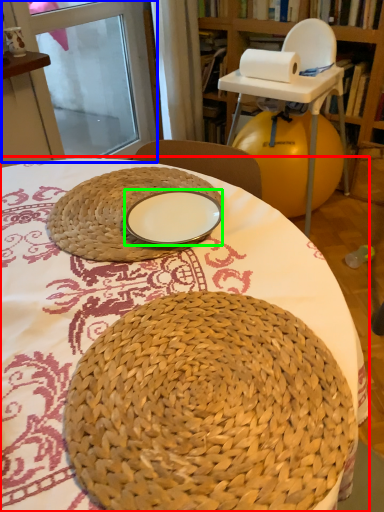
Question: Based on their relative distances, which object is farther from table (highlighted by a red box)? Choose from screen door (highlighted by a blue box) and plate (highlighted by a green box).

Choices:
 (A) screen door
 (B) plate

Answer: (A)